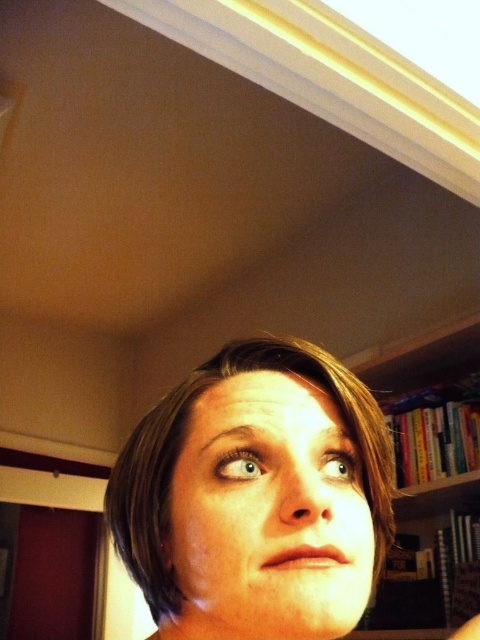
Question: Is smooth skin face at center positioned behind hardcover books at right?

Choices:
 (A) no
 (B) yes

Answer: (A)

Question: Does smooth skin face at center have a larger size compared to hardcover books at right?

Choices:
 (A) yes
 (B) no

Answer: (B)

Question: Which object is closer to the camera taking this photo?

Choices:
 (A) smooth skin face at center
 (B) hardcover books at right

Answer: (A)

Question: Is smooth skin face at center smaller than hardcover books at right?

Choices:
 (A) yes
 (B) no

Answer: (A)